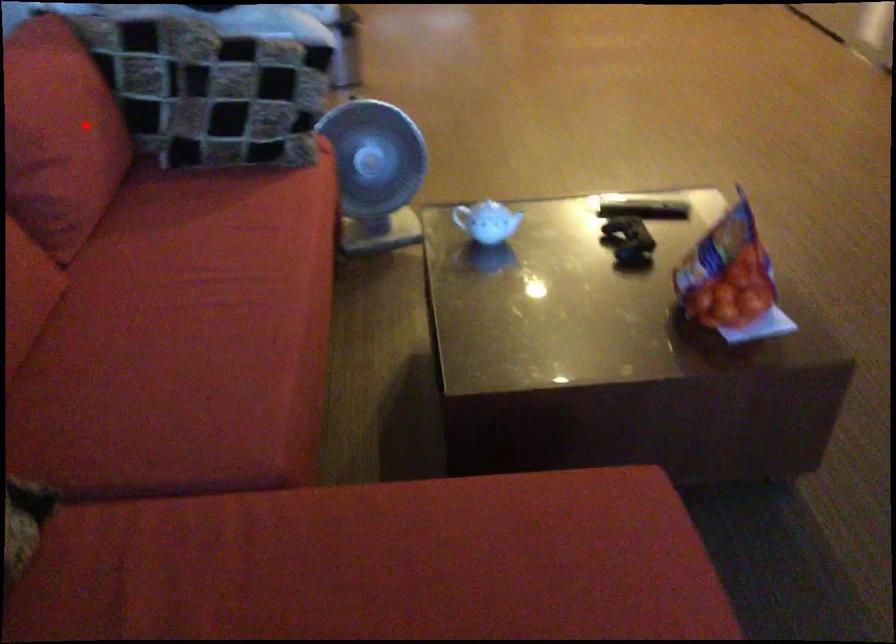
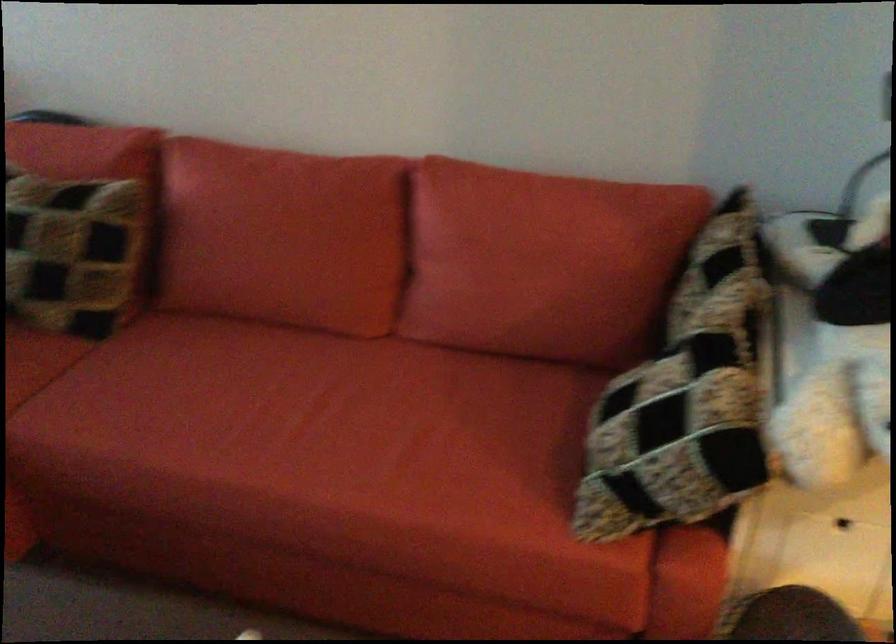
The point at the highlighted location is marked in the first image. Where is the corresponding point in the second image?

(538, 270)